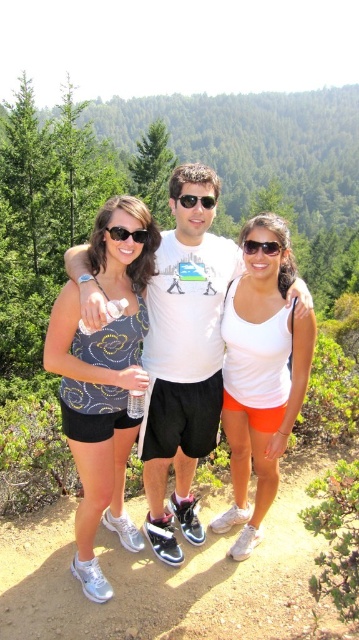
Question: Which of these objects is positioned closest to the white matte tank top at center?

Choices:
 (A) white plastic sunglasses at center
 (B) white matte t-shirt at center

Answer: (B)

Question: Can you confirm if white plastic sunglasses at center is wider than black plastic sunglasses at center?

Choices:
 (A) yes
 (B) no

Answer: (B)

Question: Can you confirm if matte blue tank top at center is bigger than black plastic sunglasses at center?

Choices:
 (A) no
 (B) yes

Answer: (B)

Question: Which of the following is the farthest from the observer?

Choices:
 (A) black plastic sunglasses at center
 (B) white plastic sunglasses at center
 (C) white matte tank top at center

Answer: (A)

Question: Which point is farther to the camera?

Choices:
 (A) (184, 426)
 (B) (244, 243)

Answer: (A)

Question: Does white matte t-shirt at center come behind matte blue tank top at center?

Choices:
 (A) no
 (B) yes

Answer: (B)